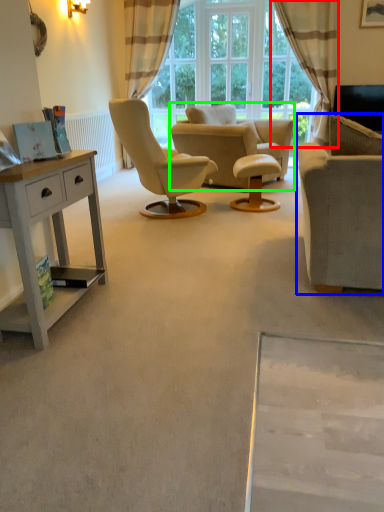
Question: Which object is positioned closest to curtain (highlighted by a red box)? Select from studio couch (highlighted by a blue box) and chair (highlighted by a green box).

Choices:
 (A) studio couch
 (B) chair

Answer: (B)